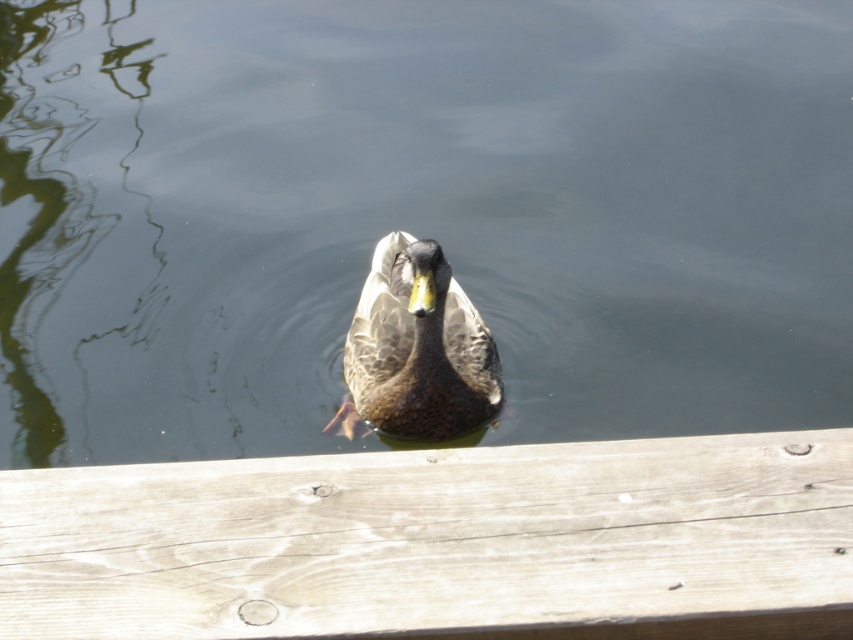
Can you confirm if greenish water at center is thinner than brown speckled duck at center?

In fact, greenish water at center might be wider than brown speckled duck at center.

Is greenish water at center to the right of brown speckled duck at center from the viewer's perspective?

No, greenish water at center is not to the right of brown speckled duck at center.

The image size is (853, 640). What do you see at coordinates (418, 212) in the screenshot?
I see `greenish water at center` at bounding box center [418, 212].

Where is `greenish water at center`? Image resolution: width=853 pixels, height=640 pixels. greenish water at center is located at coordinates (418, 212).

Does greenish water at center appear over light brown wood at center?

Yes, greenish water at center is above light brown wood at center.

Who is lower down, greenish water at center or light brown wood at center?

light brown wood at center

At what (x,y) coordinates should I click in order to perform the action: click on greenish water at center. Please return your answer as a coordinate pair (x, y). Looking at the image, I should click on (418, 212).

Identify the location of greenish water at center. The image size is (853, 640). (418, 212).

Is light brown wood at center wider than brown speckled duck at center?

Indeed, light brown wood at center has a greater width compared to brown speckled duck at center.

Which of these two, light brown wood at center or brown speckled duck at center, stands shorter?

light brown wood at center

Identify the location of light brown wood at center. (440, 541).

Find the location of a particular element. light brown wood at center is located at coordinates (440, 541).